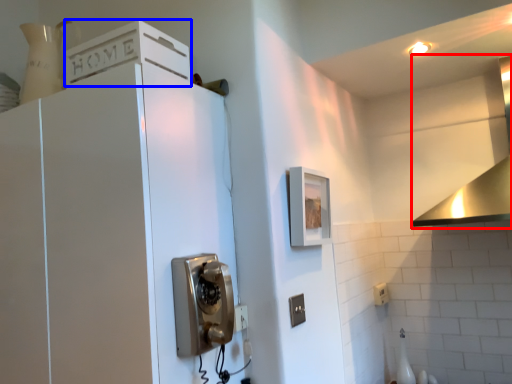
Question: Among these objects, which one is farthest to the camera, vent (highlighted by a red box) or cabinetry (highlighted by a blue box)?

Choices:
 (A) vent
 (B) cabinetry

Answer: (A)